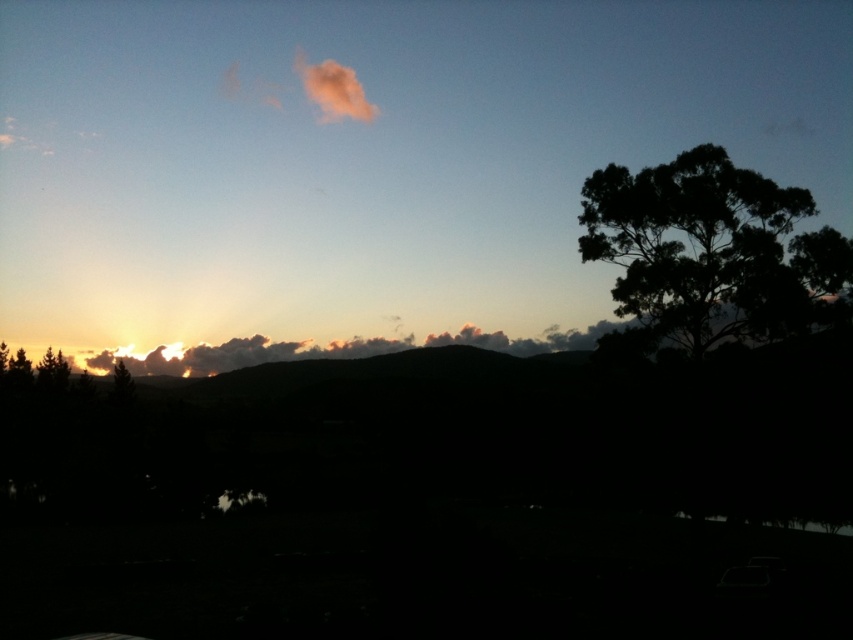
Between dark green leafy tree at right and fuzzy pink cloud at upper center, which one has less height?

dark green leafy tree at right is shorter.

Is dark green leafy tree at right behind fuzzy pink cloud at upper center?

No, it is not.

Is point (810, 321) positioned after point (328, 72)?

No, it is not.

This screenshot has height=640, width=853. Identify the location of dark green leafy tree at right. (712, 252).